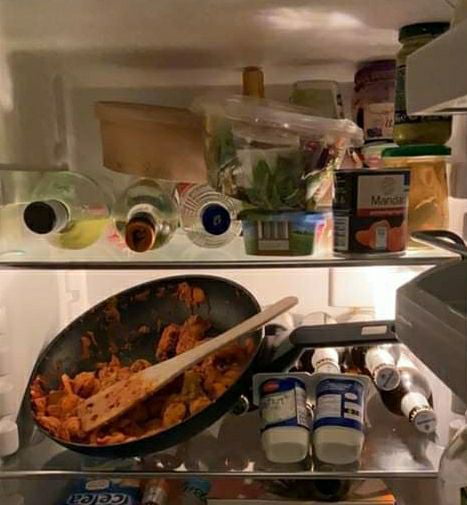
The height and width of the screenshot is (505, 467). In order to click on beer bottles in this screenshot , I will do pos(408,393), pos(379,355), pos(327,354).